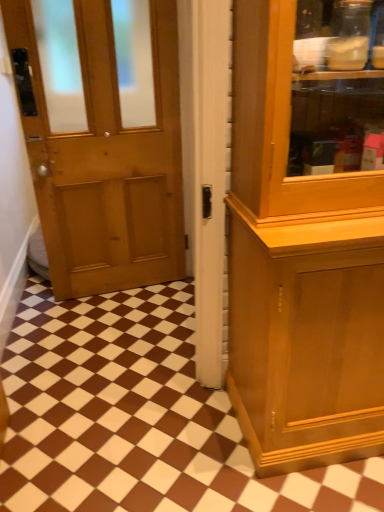
Identify the location of vacant space underneath matte wood door at center (from a real-world perspective). (112, 395).